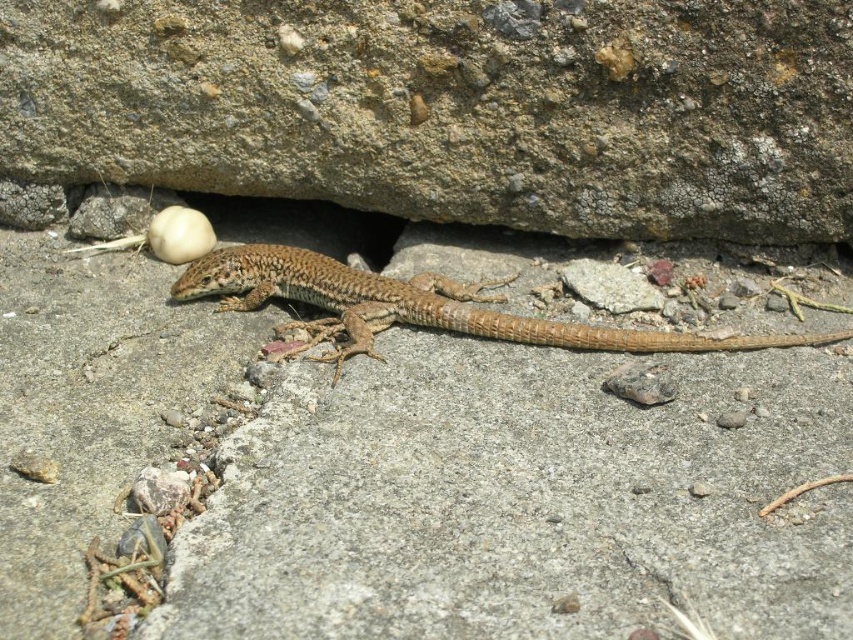
Can you confirm if brown rough stone at upper center is positioned below brown/scaly lizard at center?

Actually, brown rough stone at upper center is above brown/scaly lizard at center.

Is brown rough stone at upper center behind brown/scaly lizard at center?

No, it is in front of brown/scaly lizard at center.

Locate an element on the screen. brown rough stone at upper center is located at coordinates (451, 108).

Where is `brown rough stone at upper center`? Image resolution: width=853 pixels, height=640 pixels. brown rough stone at upper center is located at coordinates (451, 108).